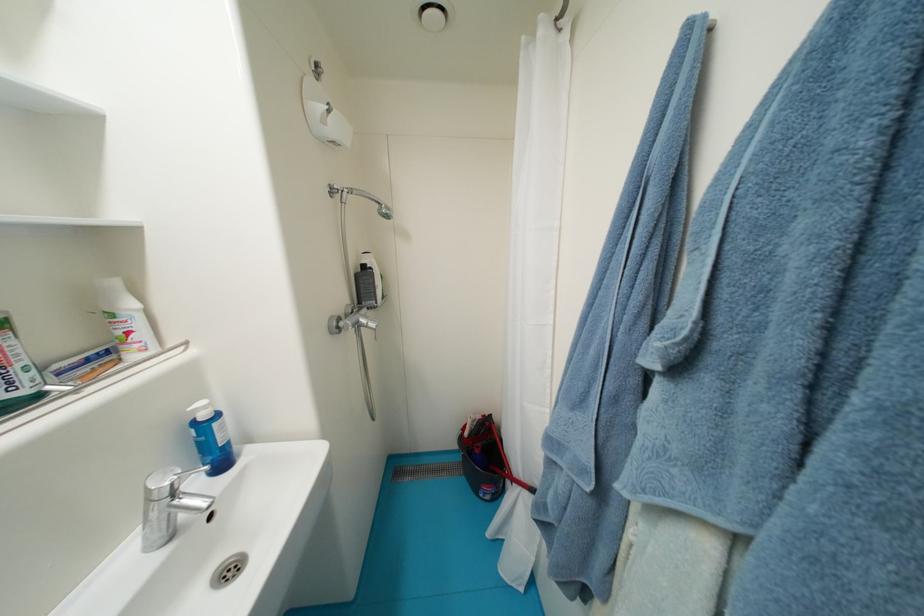
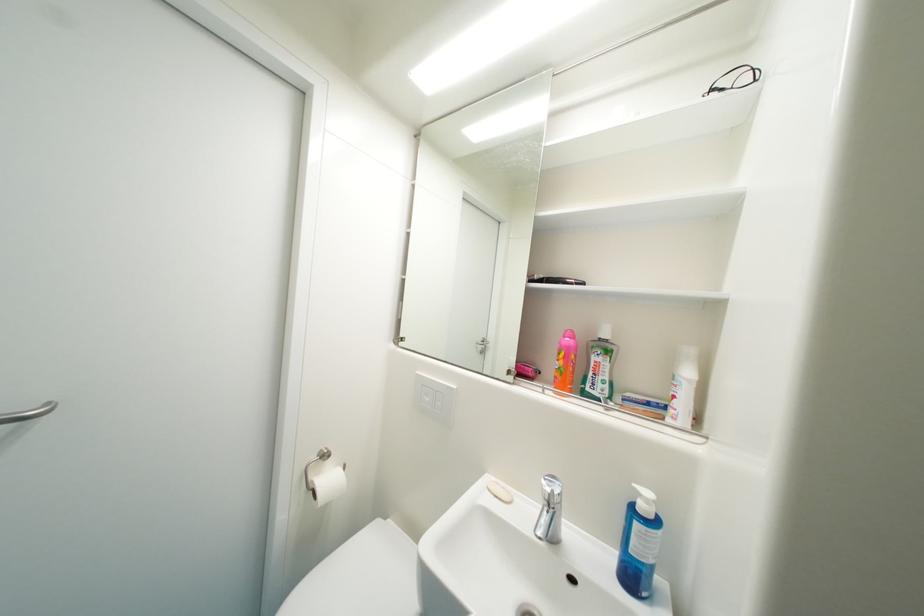
In the second image, find the point that corresponds to [64,369] in the first image.

(635, 397)